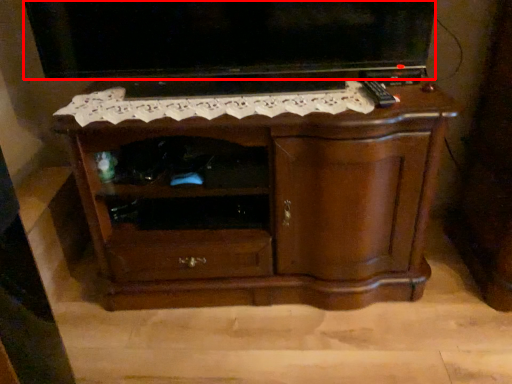
Question: From the image's perspective, what is the correct spatial relationship of television (annotated by the red box) in relation to chest of drawers?

Choices:
 (A) above
 (B) below

Answer: (A)